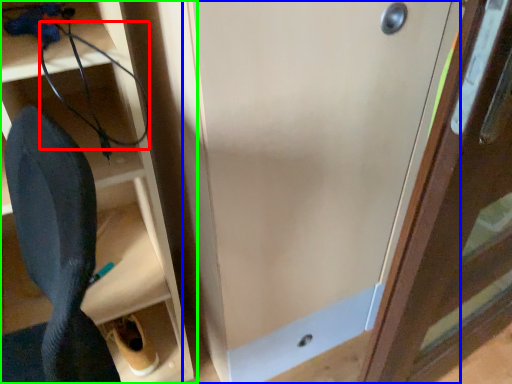
Question: Which is nearer to the wire (highlighted by a red box)? door (highlighted by a blue box) or shelf (highlighted by a green box).

Choices:
 (A) door
 (B) shelf

Answer: (B)